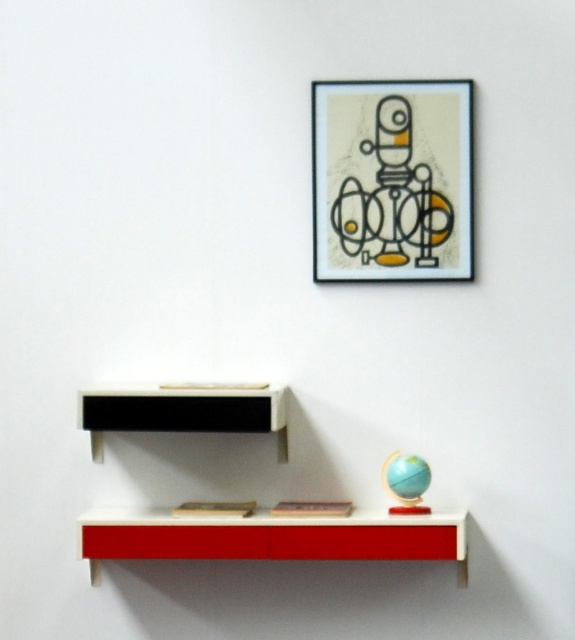
Is matte black picture frame at upper center smaller than matte red cabinet at lower center?

Yes, matte black picture frame at upper center is smaller than matte red cabinet at lower center.

Is point (401, 275) positioned in front of point (356, 520)?

No.

Is point (329, 268) in front of point (139, 529)?

No, (329, 268) is further to viewer.

Where is `matte black picture frame at upper center`? The width and height of the screenshot is (575, 640). matte black picture frame at upper center is located at coordinates [392, 180].

Who is higher up, matte red cabinet at lower center or white matte shelf at center?

white matte shelf at center is higher up.

Can you confirm if matte red cabinet at lower center is wider than white matte shelf at center?

Yes, matte red cabinet at lower center is wider than white matte shelf at center.

Locate an element on the screen. The width and height of the screenshot is (575, 640). matte red cabinet at lower center is located at coordinates (274, 536).

Does point (454, 548) lie in front of point (228, 538)?

That is True.

Is point (362, 556) positioned after point (423, 554)?

That is False.

Find the location of `white glossy bookshelf at center`. white glossy bookshelf at center is located at coordinates (273, 532).